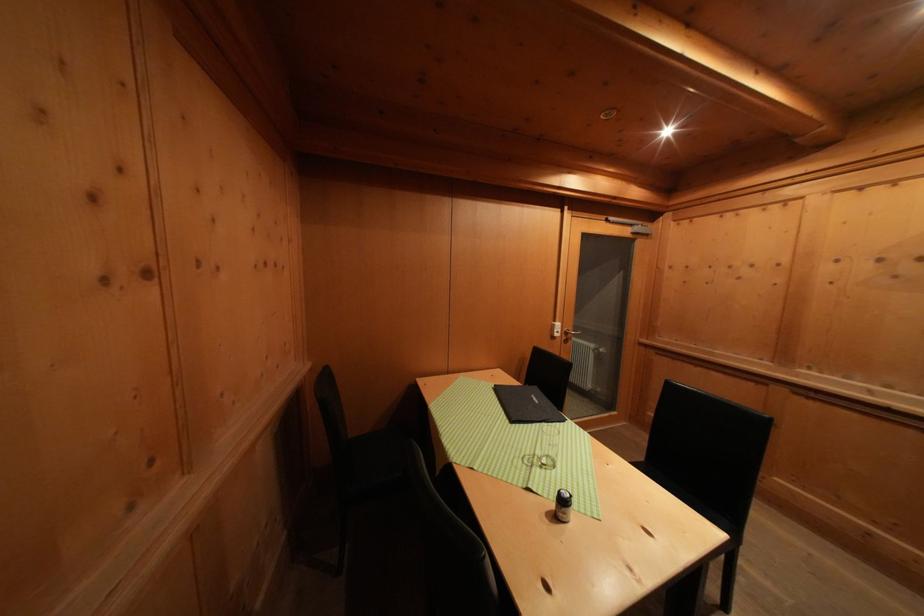
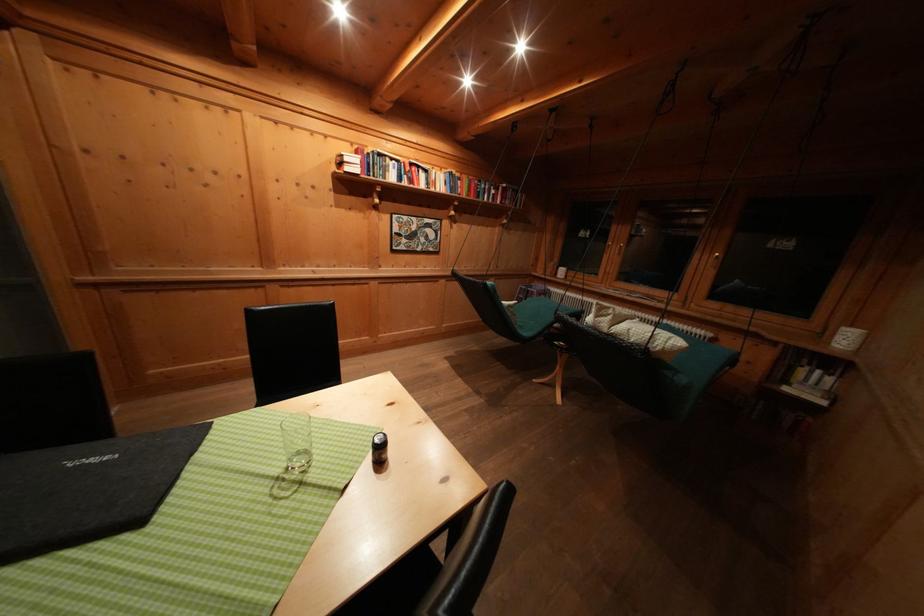
Locate, in the second image, the point that corresponds to pixel 569 506 in the first image.

(388, 448)